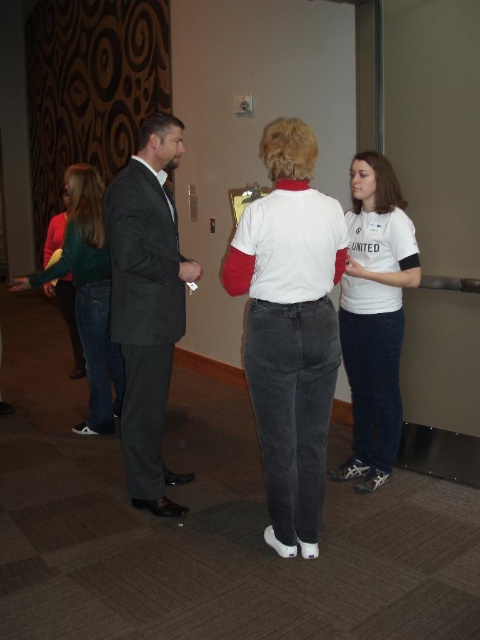
Who is more forward, (303, 205) or (360, 202)?

Positioned in front is point (303, 205).

The height and width of the screenshot is (640, 480). I want to click on white cotton shirt at center, so click(289, 330).

Can you confirm if white cotton shirt at center is bigger than dark gray suit at center?

Actually, white cotton shirt at center might be smaller than dark gray suit at center.

Where is `white cotton shirt at center`? white cotton shirt at center is located at coordinates (289, 330).

I want to click on white cotton shirt at center, so pyautogui.click(x=289, y=330).

Where is `white cotton shirt at center`? The width and height of the screenshot is (480, 640). white cotton shirt at center is located at coordinates (289, 330).

Who is higher up, blonde synthetic wig at center or dark brown hair at upper left?

dark brown hair at upper left is above.

Who is more forward, (x=284, y=134) or (x=163, y=138)?

Point (x=284, y=134) is in front.

Is point (302, 136) positioned in front of point (163, 118)?

Yes, point (302, 136) is in front of point (163, 118).

Where is `blonde synthetic wig at center`? The height and width of the screenshot is (640, 480). blonde synthetic wig at center is located at coordinates (288, 148).